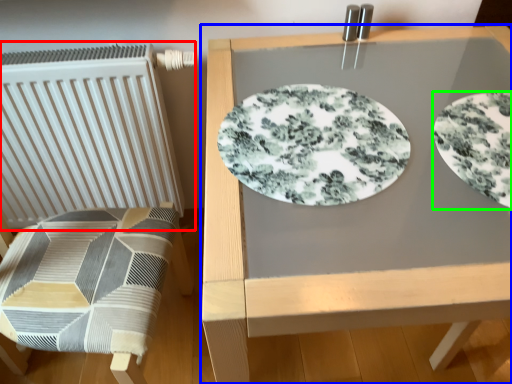
Question: Estimate the real-world distances between objects in this image. Which object is farther from radiator (highlighted by a red box), table (highlighted by a blue box) or plate (highlighted by a green box)?

Choices:
 (A) table
 (B) plate

Answer: (B)